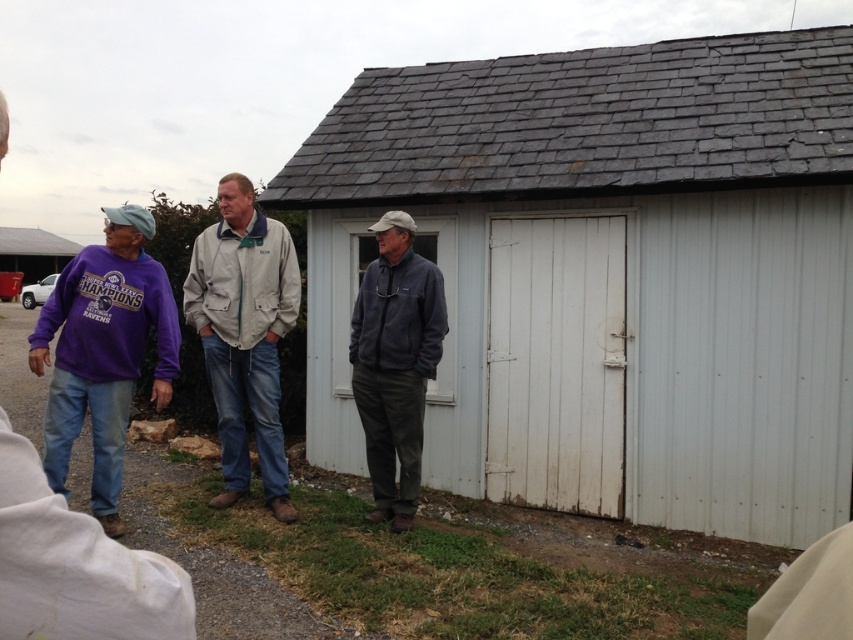
Question: Which point is closer to the camera?

Choices:
 (A) dark gray fleece jacket at center
 (B) brushed metal shed at upper left
 (C) white wood shed at center
 (D) light beige jacket at center

Answer: (C)

Question: Can you confirm if purple fleece jacket at left is wider than dark gray fleece jacket at center?

Choices:
 (A) yes
 (B) no

Answer: (A)

Question: Considering the real-world distances, which object is farthest from the purple fleece jacket at left?

Choices:
 (A) white wood shed at center
 (B) brushed metal shed at upper left

Answer: (B)

Question: Does white wood shed at center appear under brushed metal shed at upper left?

Choices:
 (A) no
 (B) yes

Answer: (B)

Question: Does dark gray fleece jacket at center come behind brushed metal shed at upper left?

Choices:
 (A) no
 (B) yes

Answer: (A)

Question: Which point is closer to the camera?

Choices:
 (A) (390, 228)
 (B) (73, 244)
 (C) (488, 134)
 (D) (236, 221)

Answer: (A)